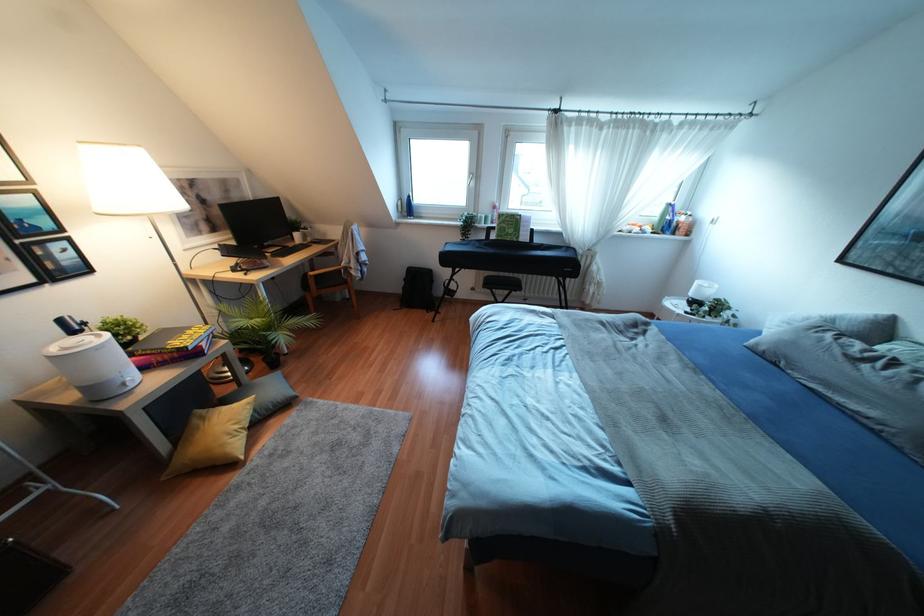
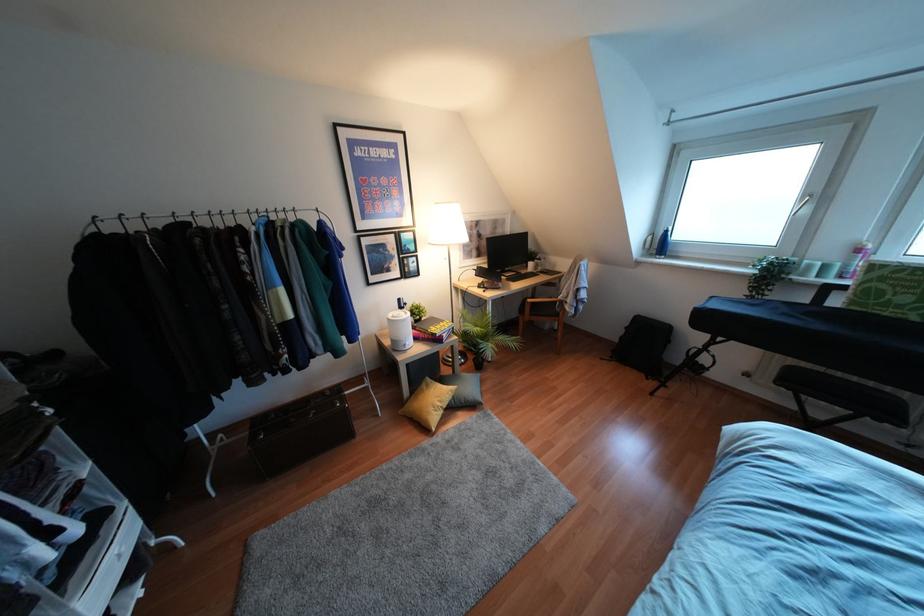
Find the pixel in the second image that matches the point at 484,217 in the first image.

(824, 267)